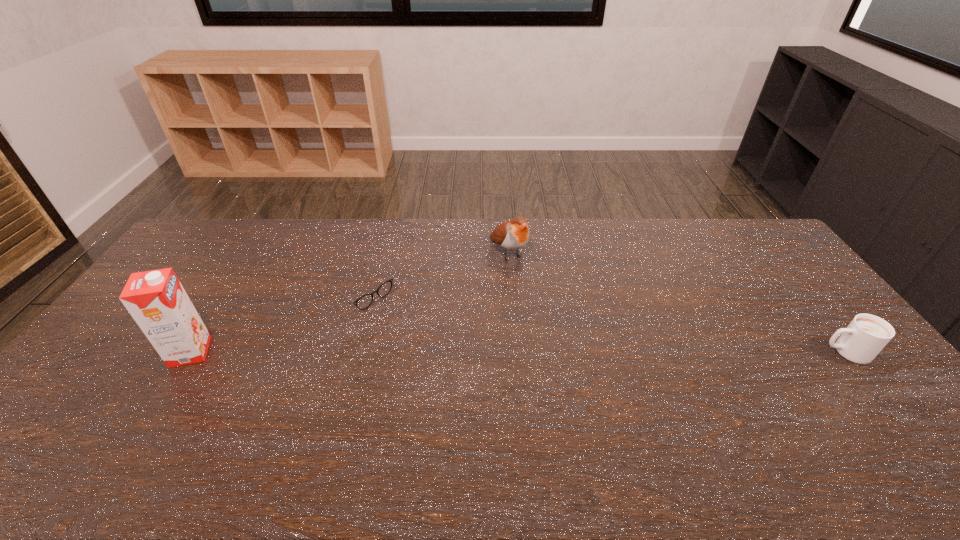
Find the location of a particular element. Image resolution: width=960 pixels, height=540 pixels. free location that satisfies the following two spatial constraints: 1. on the back side of the tallest object; 2. on the side with the handle of the rightmost object is located at coordinates (191, 352).

Where is `vacant point that satisfies the following two spatial constraints: 1. on the back side of the tallest object; 2. on the right side of the third object from left to right`? This screenshot has width=960, height=540. vacant point that satisfies the following two spatial constraints: 1. on the back side of the tallest object; 2. on the right side of the third object from left to right is located at coordinates (252, 253).